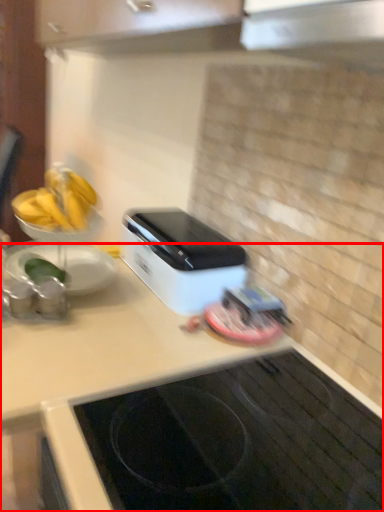
Question: From the image, what is the correct spatial relationship of countertop (annotated by the red box) in relation to home appliance?

Choices:
 (A) right
 (B) left

Answer: (A)